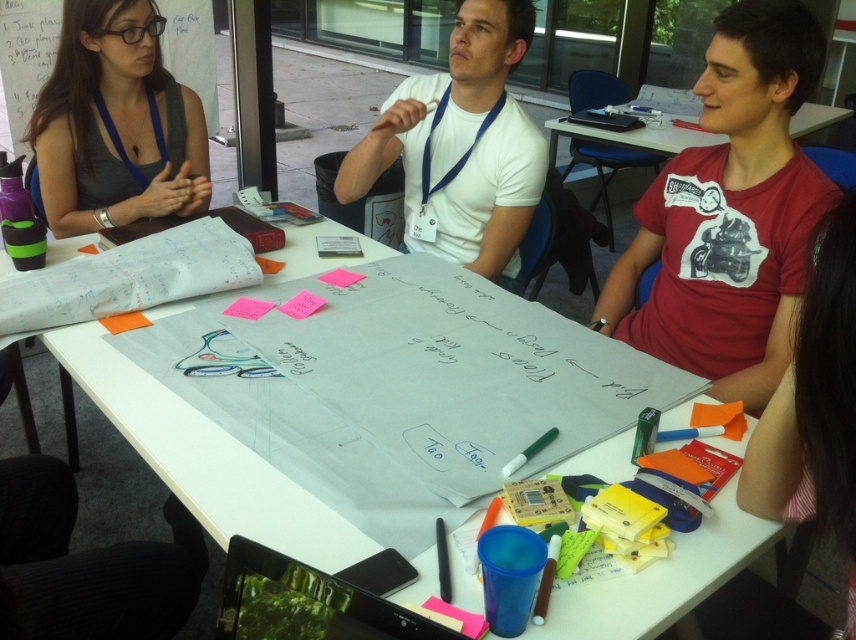
You are standing in front of the table and want to reach both the point at coordinates point (x=724, y=525) and point (x=450, y=60). Which point should you reach first to minimize the distance walked?

You should reach point (x=724, y=525) first because it is closer to you than point (x=450, y=60).

You are one of the participants in the brainstorming session and you need to move a marker from point (197, 29) to point (705, 141) on the large sheet of paper. Which direction should you move the marker relative to the current position?

You should move the marker upward and to the right because point (197, 29) is in front of point (705, 141), meaning it is lower and to the left.